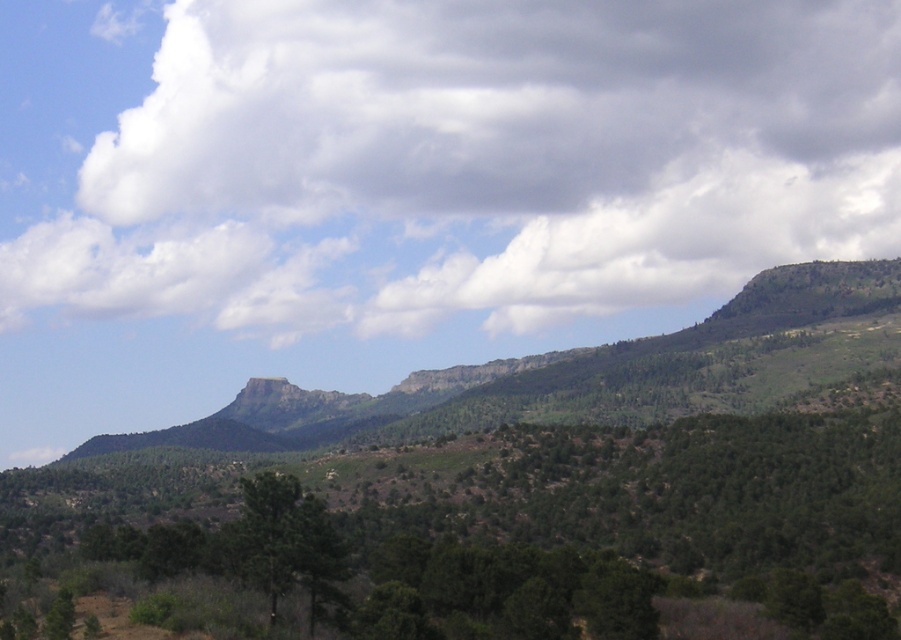
You are an airplane passenger looking out the window and see the green textured hillside at center and the white fluffy cloud at upper center. Which object is lower in the scene?

The green textured hillside at center is lower than the white fluffy cloud at upper center.

You are an explorer navigating through the landscape shown. You see two points marked on your map. The first point is at coordinate point (114,474), and the second is at point (243,170). Which point is closer to you as you stand at the starting position?

Point (114,474) is in front of point (243,170), so it is closer to you.

You are an artist planning to paint the landscape. You want to ensure the white fluffy cloud at upper center and the green matte tree at center are proportionally accurate. Which object should you make larger in your painting?

The white fluffy cloud at upper center should be made larger than the green matte tree at center in the painting because it is described as having a larger size compared to the green matte tree at center.